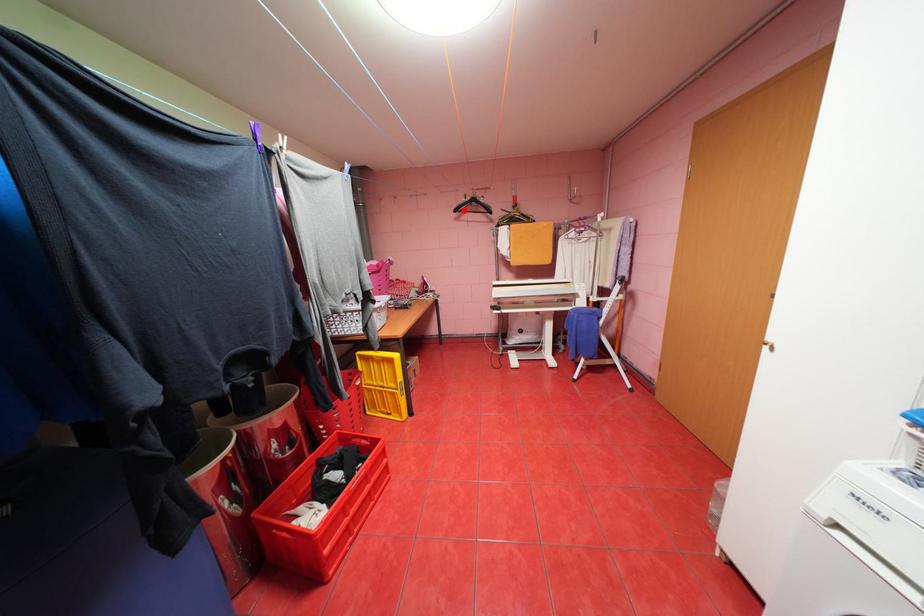
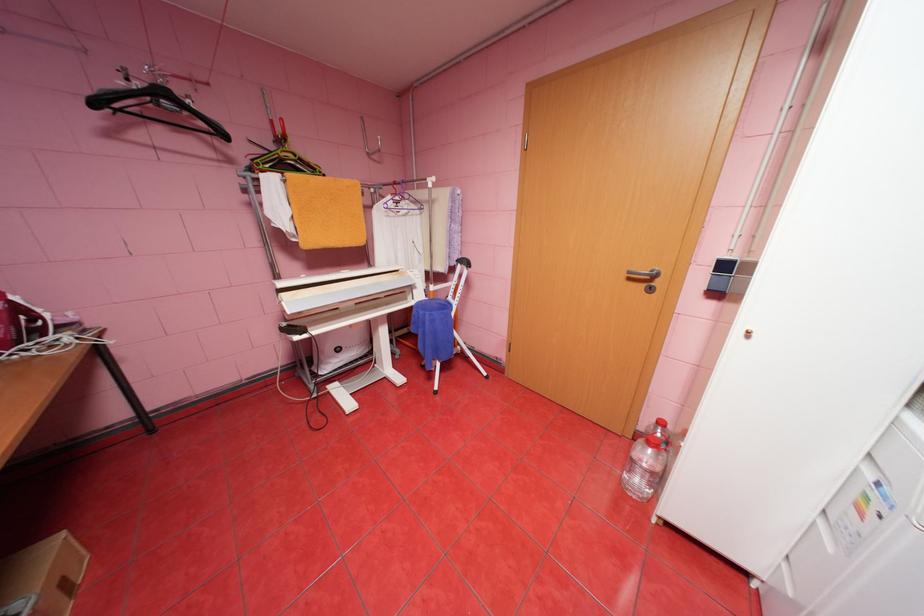
Question: I am providing you with two images of the same scene from different viewpoints. In image1, a red point is highlighted. Considering the same 3D point in image2, which of the following is correct?

Choices:
 (A) It is closer
 (B) It is farther

Answer: (B)